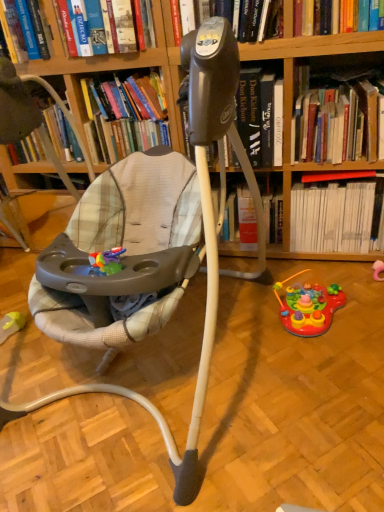
Question: Does point (26, 10) appear closer or farther from the camera than point (1, 340)?

Choices:
 (A) closer
 (B) farther

Answer: (A)

Question: From the image's perspective, relative to rubber yellow toy at lower left, which is the 3th toy from right to left, is hardcover book at upper center, which appears as the fourth book when viewed from the right, above or below?

Choices:
 (A) below
 (B) above

Answer: (B)

Question: Which object is positioned closest to the hardcover book at upper center, which appears as the fourth book when viewed from the right?

Choices:
 (A) black plastic tripod at center
 (B) rubber yellow toy at lower left, the 1th toy viewed from the left
 (C) hardcover book at upper right, arranged as the 2th book when viewed from the right
 (D) hardcover book at upper center, the second book in the left-to-right sequence
 (E) red cardboard book at upper right, which appears as the first book when viewed from the right

Answer: (D)

Question: Which object is positioned closest to the rubber yellow toy at lower left, which is the 3th toy from right to left?

Choices:
 (A) pink rubber toy at lower right, the 1th toy viewed from the right
 (B) rubberized plastic activity center at lower right, the 2th toy positioned from the left
 (C) hardcover book at upper center, which is counted as the first book, starting from the left
 (D) plush fabric baby carriage at center
 (E) red cardboard book at upper right, which is the fourth book from left to right

Answer: (D)